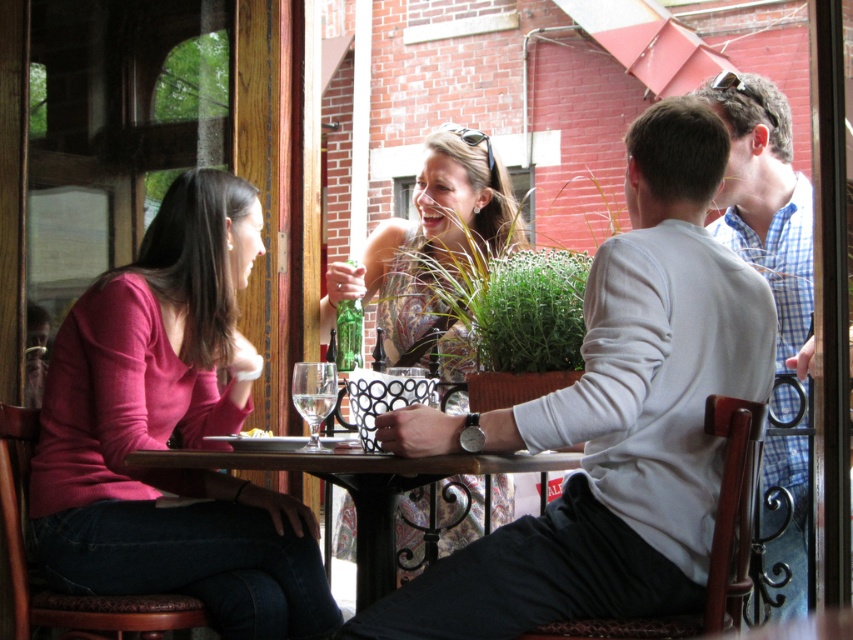
Question: Is light gray sweater at right positioned behind yellow crumbly food at table center?

Choices:
 (A) yes
 (B) no

Answer: (A)

Question: Which point is farther to the camera?

Choices:
 (A) light gray sweater at right
 (B) patterned fabric dress at center

Answer: (B)

Question: Is light gray sweater at center in front of patterned fabric dress at center?

Choices:
 (A) no
 (B) yes

Answer: (B)

Question: In this image, where is clear glass wine glass at table center located relative to green glass bottle at center?

Choices:
 (A) below
 (B) above

Answer: (A)

Question: Which object appears closest to the camera in this image?

Choices:
 (A) clear glass wine at table center
 (B) patterned fabric dress at center
 (C) matte pink sweater at left

Answer: (A)

Question: Among these points, which one is farthest from the camera?

Choices:
 (A) coord(387,520)
 (B) coord(73,401)

Answer: (B)